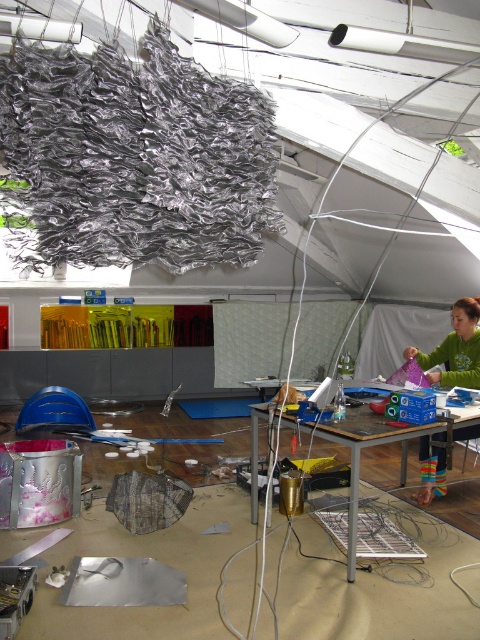
You are an artist who needs to decide whether to place a new sculpture on the green fabric at lower right or the metallic silver table at center. Based on their thickness, which surface can better support heavier items?

The metallic silver table at center is thicker than the green fabric at lower right, so it can better support heavier items.

You are an artist who needs to place a 40 inch long sculpture between the green fabric at lower right and the metallic silver table at center. Can the sculpture fit in the space between them?

The green fabric at lower right is 37.75 inches from the metallic silver table at center. Since the sculpture is 40 inches long, it cannot fit in the space between them as the distance is shorter than the sculpture.

You are an artist who needs to place a new sculpture on the metallic silver table at center. However, there is a green fabric at lower right covering part of it. Can you still place the sculpture on the table without moving the fabric?

The green fabric at lower right is positioned over metallic silver table at center, so part of the table is covered. You can place the sculpture on the uncovered areas of the metallic silver table at center not covered by the green fabric at lower right.